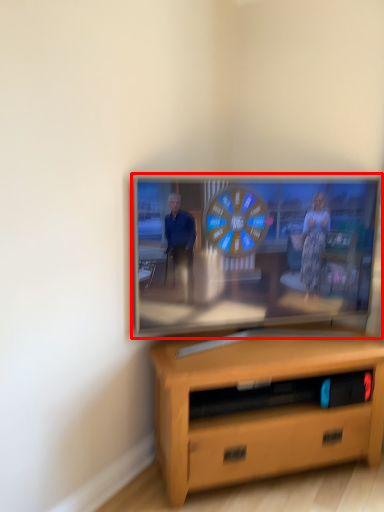
Question: In this image, where is television (annotated by the red box) located relative to desk?

Choices:
 (A) left
 (B) right

Answer: (A)